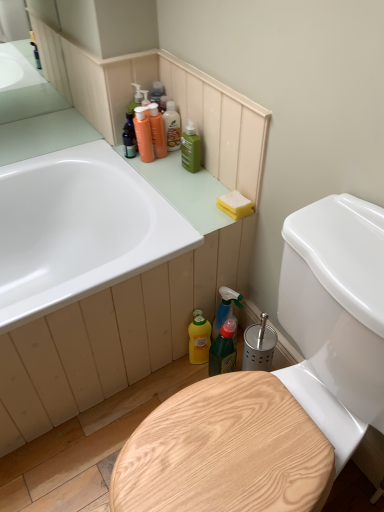
Question: From a real-world perspective, is green plastic spray bottle at lower center positioned under green matte bottle at upper center, which is the third cleaning product from bottom to top, based on gravity?

Choices:
 (A) no
 (B) yes

Answer: (B)

Question: Considering the relative sizes of green plastic spray bottle at lower center and green matte bottle at upper center, the 4th cleaning product positioned from the top, in the image provided, is green plastic spray bottle at lower center smaller than green matte bottle at upper center, the 4th cleaning product positioned from the top,?

Choices:
 (A) no
 (B) yes

Answer: (A)

Question: Is green plastic spray bottle at lower center in front of green matte bottle at upper center, which is the third cleaning product from bottom to top?

Choices:
 (A) yes
 (B) no

Answer: (A)

Question: Is green plastic spray bottle at lower center positioned far away from green matte bottle at upper center, which is the third cleaning product from bottom to top?

Choices:
 (A) no
 (B) yes

Answer: (A)

Question: Is green plastic spray bottle at lower center in contact with green matte bottle at upper center, which is the third cleaning product from bottom to top?

Choices:
 (A) no
 (B) yes

Answer: (A)

Question: Considering the relative sizes of green plastic spray bottle at lower center and green matte bottle at upper center, which is the third cleaning product from bottom to top, in the image provided, is green plastic spray bottle at lower center shorter than green matte bottle at upper center, which is the third cleaning product from bottom to top,?

Choices:
 (A) no
 (B) yes

Answer: (A)

Question: Is translucent amber bottle at upper center, the first cleaning product from the top, facing towards green plastic spray bottle at lower center?

Choices:
 (A) no
 (B) yes

Answer: (A)

Question: Is green plastic spray bottle at lower center surrounded by translucent amber bottle at upper center, which is the sixth cleaning product from bottom to top?

Choices:
 (A) yes
 (B) no

Answer: (B)

Question: From a real-world perspective, does translucent amber bottle at upper center, which is the sixth cleaning product from bottom to top, stand above green plastic spray bottle at lower center?

Choices:
 (A) no
 (B) yes

Answer: (B)

Question: Does translucent amber bottle at upper center, which is the sixth cleaning product from bottom to top, have a smaller size compared to green plastic spray bottle at lower center?

Choices:
 (A) no
 (B) yes

Answer: (B)

Question: Is translucent amber bottle at upper center, which is the sixth cleaning product from bottom to top, facing away from green plastic spray bottle at lower center?

Choices:
 (A) no
 (B) yes

Answer: (A)

Question: Does translucent amber bottle at upper center, which is the sixth cleaning product from bottom to top, lie behind green plastic spray bottle at lower center?

Choices:
 (A) no
 (B) yes

Answer: (B)

Question: From a real-world perspective, does yellow sponge at upper right sit lower than green matte bottle at upper center, the 4th cleaning product positioned from the top?

Choices:
 (A) no
 (B) yes

Answer: (B)